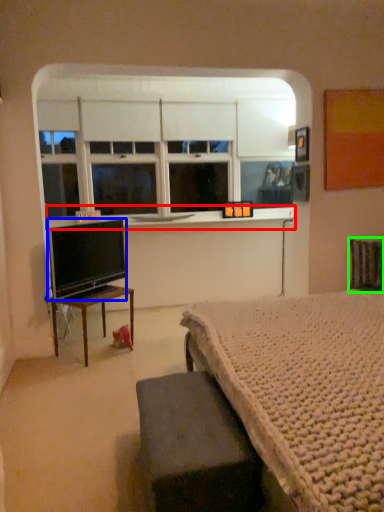
Question: Which object is the farthest from window sill (highlighted by a red box)? Choose among these: television (highlighted by a blue box) or swivel chair (highlighted by a green box).

Choices:
 (A) television
 (B) swivel chair

Answer: (B)